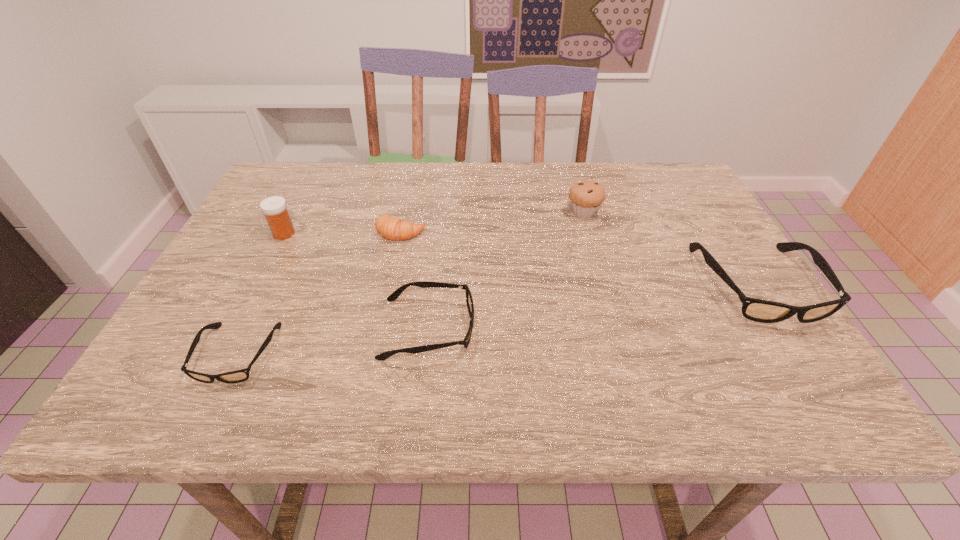
If the aim is uniform spacing by inserting an additional spectacles among them, please point to a vacant space for this new spectacles. Please provide its 2D coordinates. Your answer should be formatted as a tuple, i.e. [(x, y)], where the tuple contains the x and y coordinates of a point satisfying the conditions above.

[(600, 306)]